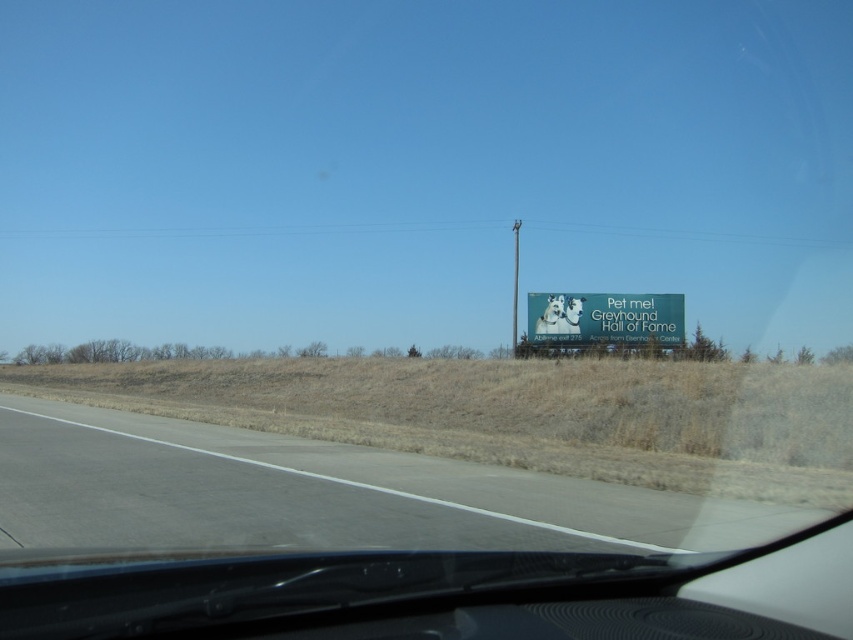
Question: Which object appears farthest from the camera in this image?

Choices:
 (A) white glossy billboard at right
 (B) gray asphalt road at lower left

Answer: (A)

Question: From the image, what is the correct spatial relationship of gray asphalt road at lower left in relation to white glossy billboard at right?

Choices:
 (A) right
 (B) left

Answer: (B)

Question: Among these objects, which one is farthest from the camera?

Choices:
 (A) white glossy billboard at right
 (B) gray asphalt road at lower left

Answer: (A)

Question: Where is gray asphalt road at lower left located in relation to white glossy billboard at right in the image?

Choices:
 (A) above
 (B) below

Answer: (B)

Question: Does gray asphalt road at lower left lie behind white glossy billboard at right?

Choices:
 (A) no
 (B) yes

Answer: (A)